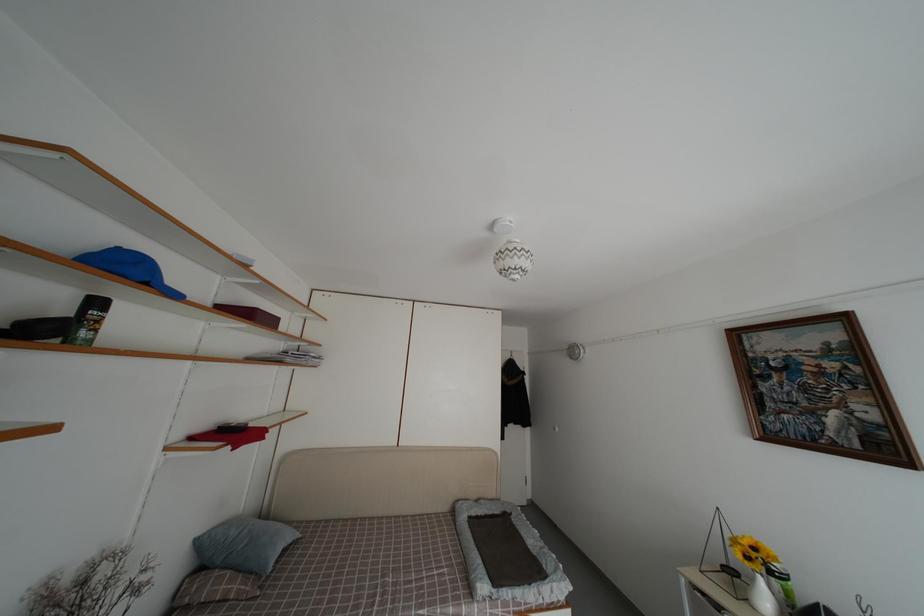
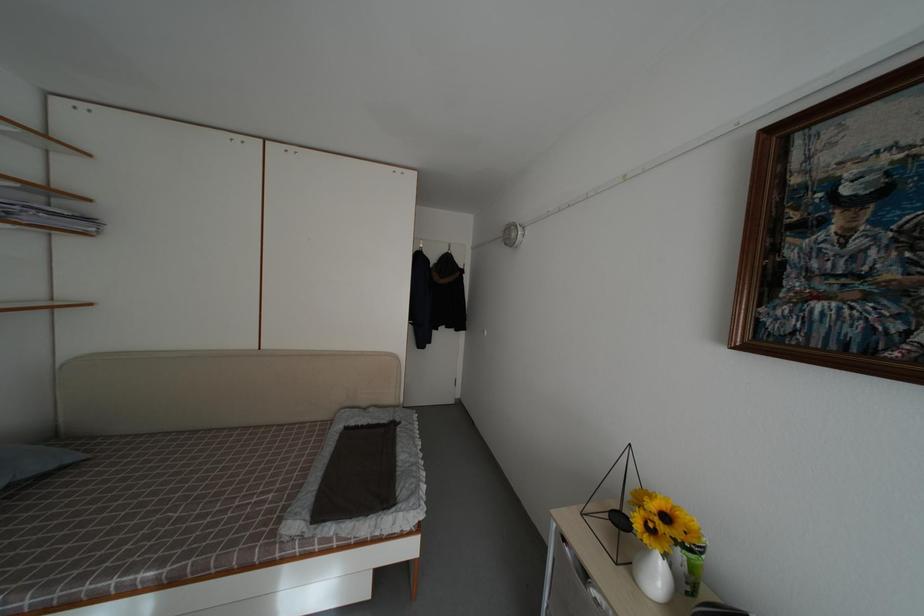
Locate, in the second image, the point that corresponds to point (295, 543) in the first image.

(50, 469)